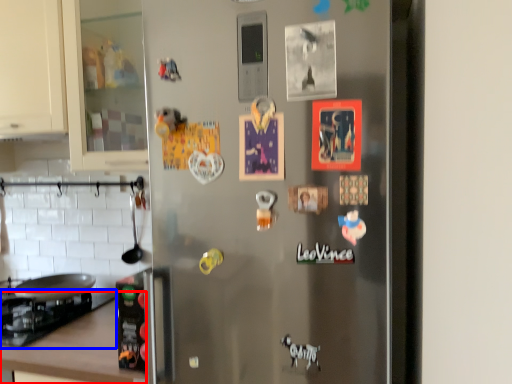
Question: Which of the following is the closest to the observer, counter top (highlighted by a red box) or gas stove (highlighted by a blue box)?

Choices:
 (A) counter top
 (B) gas stove

Answer: (A)